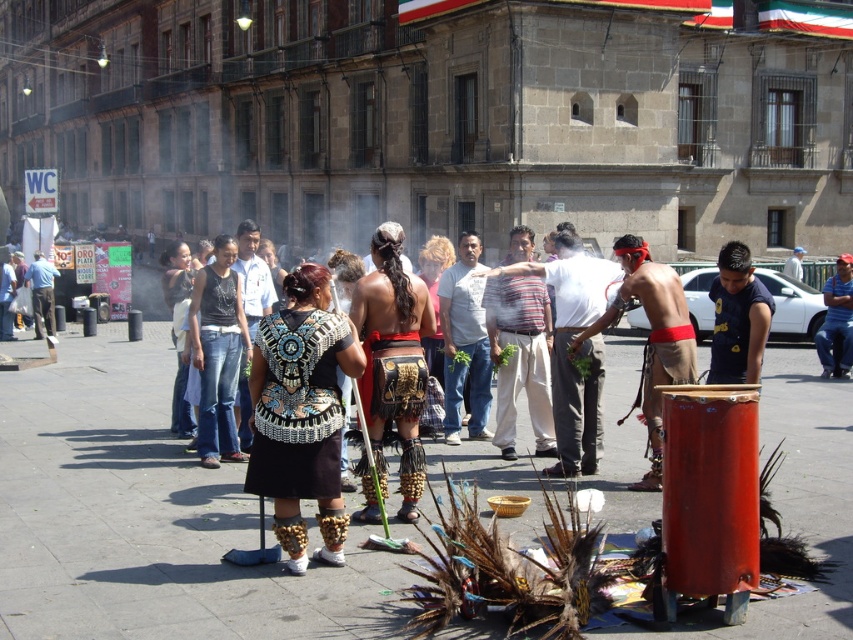
Between striped cotton shirt at center and shiny red cloth at center, which one appears on the left side from the viewer's perspective?

striped cotton shirt at center is more to the left.

Does striped cotton shirt at center appear under shiny red cloth at center?

Yes, striped cotton shirt at center is below shiny red cloth at center.

The height and width of the screenshot is (640, 853). Find the location of `striped cotton shirt at center`. striped cotton shirt at center is located at coordinates (520, 356).

Between point (392, 280) and point (198, 355), which one is positioned in front?

Positioned in front is point (392, 280).

The image size is (853, 640). What do you see at coordinates (392, 365) in the screenshot?
I see `gold beaded skirt at center` at bounding box center [392, 365].

Find the location of a particular element. gold beaded skirt at center is located at coordinates (392, 365).

Does shiny red cloth at center lie behind blue denim jeans at left?

No, it is in front of blue denim jeans at left.

From the picture: Is shiny red cloth at center wider than blue denim jeans at left?

No.

You are a GUI agent. You are given a task and a screenshot of the screen. Output one action in this format:
    pyautogui.click(x=<x>, y=<y>)
    Task: Click on the shiny red cloth at center
    
    Given the screenshot: What is the action you would take?
    pyautogui.click(x=651, y=339)